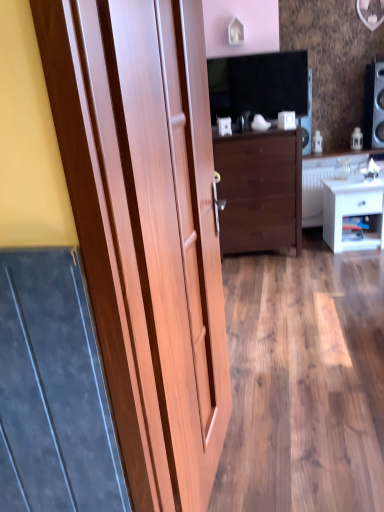
At what (x,y) coordinates should I click in order to perform the action: click on free space in front of dark wood chest of drawers at center. Please return your answer as a coordinate pair (x, y). The width and height of the screenshot is (384, 512). Looking at the image, I should click on (270, 267).